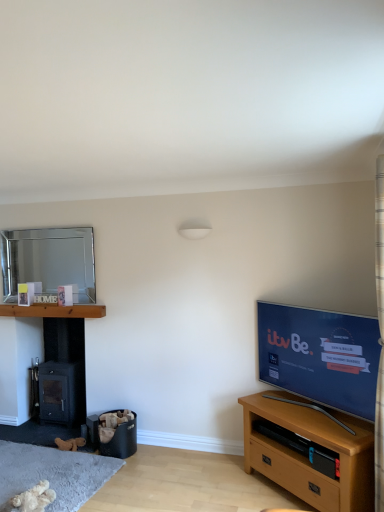
Image resolution: width=384 pixels, height=512 pixels. Find the location of `fluffy beige teddy bear at lower left`. fluffy beige teddy bear at lower left is located at coordinates (52, 474).

From the picture: What is the approximate height of black plastic trash bin at lower left?

black plastic trash bin at lower left is 13.47 inches tall.

Identify the location of matte black tv at right. The image size is (384, 512). (320, 356).

Measure the distance between wooden at left, marked as the first shelf in a top-to-bottom arrangement, and camera.

The depth of wooden at left, marked as the first shelf in a top-to-bottom arrangement, is 12.62 feet.

I want to click on wooden tv stand at lower right, the 2th shelf when ordered from left to right, so click(302, 447).

Is light brown wooden tv stand at lower right facing away from matte black tv at right?

No, light brown wooden tv stand at lower right's orientation is not away from matte black tv at right.

From a real-world perspective, is light brown wooden tv stand at lower right below matte black tv at right?

Yes, from a real-world perspective, light brown wooden tv stand at lower right is below matte black tv at right.

Are light brown wooden tv stand at lower right and matte black tv at right making contact?

There is a gap between light brown wooden tv stand at lower right and matte black tv at right.

Is light brown wooden tv stand at lower right far from black plastic trash bin at lower left?

light brown wooden tv stand at lower right is far away from black plastic trash bin at lower left.

Would you say light brown wooden tv stand at lower right is to the left or to the right of black plastic trash bin at lower left in the picture?

light brown wooden tv stand at lower right is positioned on black plastic trash bin at lower left's right side.

Is light brown wooden tv stand at lower right further to the viewer compared to black plastic trash bin at lower left?

No, the depth of light brown wooden tv stand at lower right is less than that of black plastic trash bin at lower left.

How many degrees apart are the facing directions of light brown wooden tv stand at lower right and black plastic trash bin at lower left?

38.7 degrees.

From the picture: From the image's perspective, is fluffy beige teddy bear at lower left located above or below silver metallic mirror at upper left?

fluffy beige teddy bear at lower left is situated lower than silver metallic mirror at upper left in the image.

Locate an element on the screen. mirror above the fluffy beige teddy bear at lower left (from a real-world perspective) is located at coordinates (48, 260).

Looking at this image, considering the sizes of objects fluffy beige teddy bear at lower left and silver metallic mirror at upper left in the image provided, who is smaller, fluffy beige teddy bear at lower left or silver metallic mirror at upper left?

Smaller between the two is silver metallic mirror at upper left.

Is silver metallic mirror at upper left inside fluffy beige teddy bear at lower left?

No, silver metallic mirror at upper left is not a part of fluffy beige teddy bear at lower left.

Does silver metallic mirror at upper left have a smaller size compared to matte black tv at right?

Indeed, silver metallic mirror at upper left has a smaller size compared to matte black tv at right.

Consider the image. What's the angular difference between silver metallic mirror at upper left and matte black tv at right's facing directions?

The angular difference between silver metallic mirror at upper left and matte black tv at right is 41.3 degrees.

Between point (91, 284) and point (264, 378), which one is positioned in front?

The point (264, 378) is more forward.

Between plaid fabric curtain at upper right and fluffy beige teddy bear at lower left, which one has larger size?

plaid fabric curtain at upper right.

Locate an element on the screen. Image resolution: width=384 pixels, height=512 pixels. plain on the left of plaid fabric curtain at upper right is located at coordinates (52, 474).

How much distance is there between plaid fabric curtain at upper right and fluffy beige teddy bear at lower left?

plaid fabric curtain at upper right is 7.48 feet from fluffy beige teddy bear at lower left.

Which is in front, point (379, 415) or point (51, 481)?

The point (379, 415) is closer.

Is point (129, 431) farther from camera compared to point (25, 463)?

That is True.

Image resolution: width=384 pixels, height=512 pixels. I want to click on trash bin/can above the fluffy beige teddy bear at lower left (from a real-world perspective), so click(121, 441).

Is fluffy beige teddy bear at lower left completely or partially inside black plastic trash bin at lower left?

Definitely not — fluffy beige teddy bear at lower left is not inside black plastic trash bin at lower left.

How much distance is there between black plastic trash bin at lower left and fluffy beige teddy bear at lower left?

A distance of 15.83 inches exists between black plastic trash bin at lower left and fluffy beige teddy bear at lower left.

Is wooden at left, which is the 2th shelf in bottom-to-top order, at the right side of light brown wooden tv stand at lower right?

In fact, wooden at left, which is the 2th shelf in bottom-to-top order, is to the left of light brown wooden tv stand at lower right.

From the image's perspective, who appears lower, wooden at left, which appears as the first shelf when viewed from the left, or light brown wooden tv stand at lower right?

light brown wooden tv stand at lower right, from the image's perspective.

Considering the relative sizes of wooden at left, which appears as the first shelf when viewed from the left, and light brown wooden tv stand at lower right in the image provided, is wooden at left, which appears as the first shelf when viewed from the left, bigger than light brown wooden tv stand at lower right?

No, wooden at left, which appears as the first shelf when viewed from the left, is not bigger than light brown wooden tv stand at lower right.

From a real-world perspective, is wooden at left, the 2th shelf from the front, positioned above or below light brown wooden tv stand at lower right?

wooden at left, the 2th shelf from the front, is above light brown wooden tv stand at lower right.

The width and height of the screenshot is (384, 512). In order to click on television behind the light brown wooden tv stand at lower right in this screenshot , I will do `click(320, 356)`.

Where is `cabinetry lying above the black plastic trash bin at lower left (from the image's perspective)`? Image resolution: width=384 pixels, height=512 pixels. cabinetry lying above the black plastic trash bin at lower left (from the image's perspective) is located at coordinates (307, 456).

Considering their positions, is wooden tv stand at lower right, which ranks as the 1th shelf in bottom-to-top order, positioned further to wooden at left, the 2th shelf from the front, than black plastic trash bin at lower left?

Among the two, wooden tv stand at lower right, which ranks as the 1th shelf in bottom-to-top order, is located further to wooden at left, the 2th shelf from the front.

Considering their positions, is plaid fabric curtain at upper right positioned further to matte black tv at right than silver metallic mirror at upper left?

silver metallic mirror at upper left is further to matte black tv at right.

Estimate the real-world distances between objects in this image. Which object is further from wooden at left, marked as the first shelf in a top-to-bottom arrangement, light brown wooden tv stand at lower right or black plastic trash bin at lower left?

light brown wooden tv stand at lower right is further to wooden at left, marked as the first shelf in a top-to-bottom arrangement.

Estimate the real-world distances between objects in this image. Which object is further from black plastic trash bin at lower left, matte black tv at right or silver metallic mirror at upper left?

The object further to black plastic trash bin at lower left is silver metallic mirror at upper left.

Consider the image. Considering their positions, is plaid fabric curtain at upper right positioned closer to black plastic trash bin at lower left than matte black tv at right?

matte black tv at right is positioned closer to the anchor black plastic trash bin at lower left.

Considering their positions, is black plastic trash bin at lower left positioned further to matte black tv at right than plaid fabric curtain at upper right?

Among the two, black plastic trash bin at lower left is located further to matte black tv at right.

Looking at the image, which one is located further to fluffy beige teddy bear at lower left, plaid fabric curtain at upper right or silver metallic mirror at upper left?

Among the two, plaid fabric curtain at upper right is located further to fluffy beige teddy bear at lower left.

Looking at the image, which one is located further to fluffy beige teddy bear at lower left, wooden at left, the 2th shelf from the front, or wooden tv stand at lower right, the 2th shelf when ordered from left to right?

wooden tv stand at lower right, the 2th shelf when ordered from left to right, lies further to fluffy beige teddy bear at lower left than the other object.

At what (x,y) coordinates should I click in order to perform the action: click on shelf between fluffy beige teddy bear at lower left and matte black tv at right. Please return your answer as a coordinate pair (x, y). This screenshot has width=384, height=512. Looking at the image, I should click on (302, 447).

Identify the location of trash bin/can between fluffy beige teddy bear at lower left and matte black tv at right from left to right. This screenshot has height=512, width=384. (121, 441).

This screenshot has width=384, height=512. Find the location of `television between plaid fabric curtain at upper right and wooden tv stand at lower right, which is counted as the second shelf, starting from the top, from top to bottom`. television between plaid fabric curtain at upper right and wooden tv stand at lower right, which is counted as the second shelf, starting from the top, from top to bottom is located at coordinates (320, 356).

Find the location of a particular element. plain between silver metallic mirror at upper left and wooden tv stand at lower right, the 2th shelf when ordered from left to right is located at coordinates (52, 474).